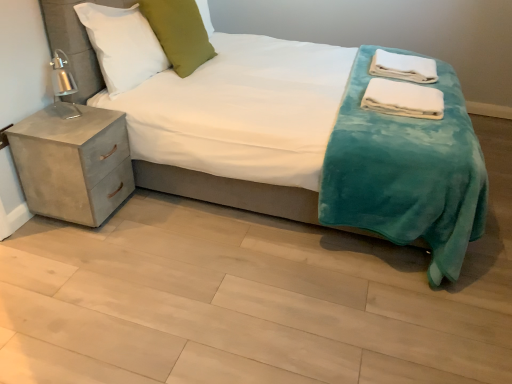
Question: Is white soft towels at right, positioned as the 1th material in front-to-back order, in front of or behind green velvet pillow at upper center, which appears as the second pillow when viewed from the left, in the image?

Choices:
 (A) behind
 (B) front

Answer: (B)

Question: Visually, is white soft towels at right, the 1th material from the bottom, positioned to the left or to the right of green velvet pillow at upper center, the first pillow when ordered from right to left?

Choices:
 (A) right
 (B) left

Answer: (A)

Question: Considering the real-world distances, which object is farthest from the white soft towels at upper right, the 1th material positioned from the back?

Choices:
 (A) green velvet pillow at upper center, which appears as the second pillow when viewed from the left
 (B) white soft pillow at upper left, the 1th pillow positioned from the left
 (C) concrete nightstand at left
 (D) white soft towels at right, arranged as the second material when viewed from the top
 (E) teal plush blanket at center

Answer: (C)

Question: Based on their relative distances, which object is farther from the white soft towels at right, positioned as the 1th material in front-to-back order?

Choices:
 (A) white soft pillow at upper left, the 1th pillow positioned from the left
 (B) white soft towels at upper right, placed as the 2th material when sorted from front to back
 (C) green velvet pillow at upper center, the first pillow when ordered from right to left
 (D) concrete nightstand at left
 (E) teal plush blanket at center

Answer: (D)